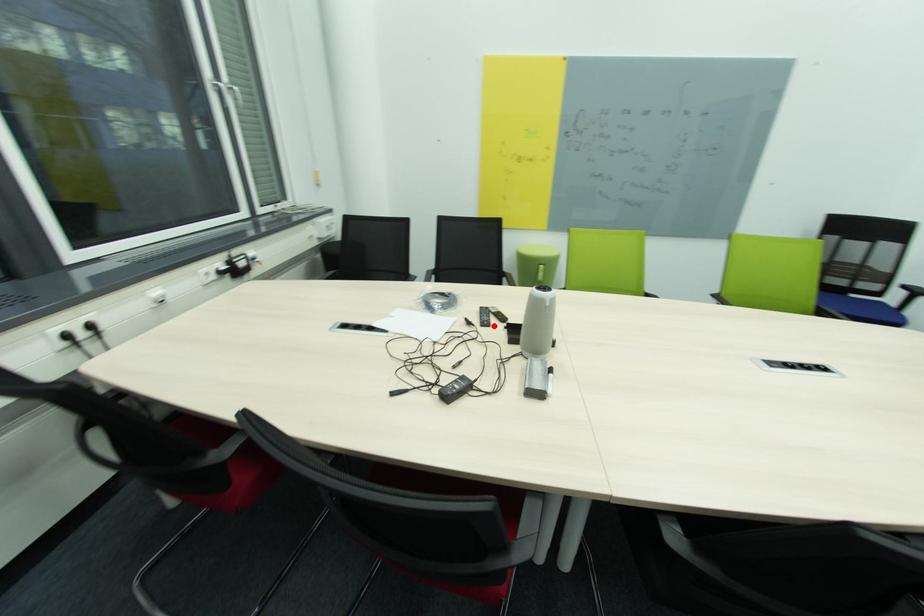
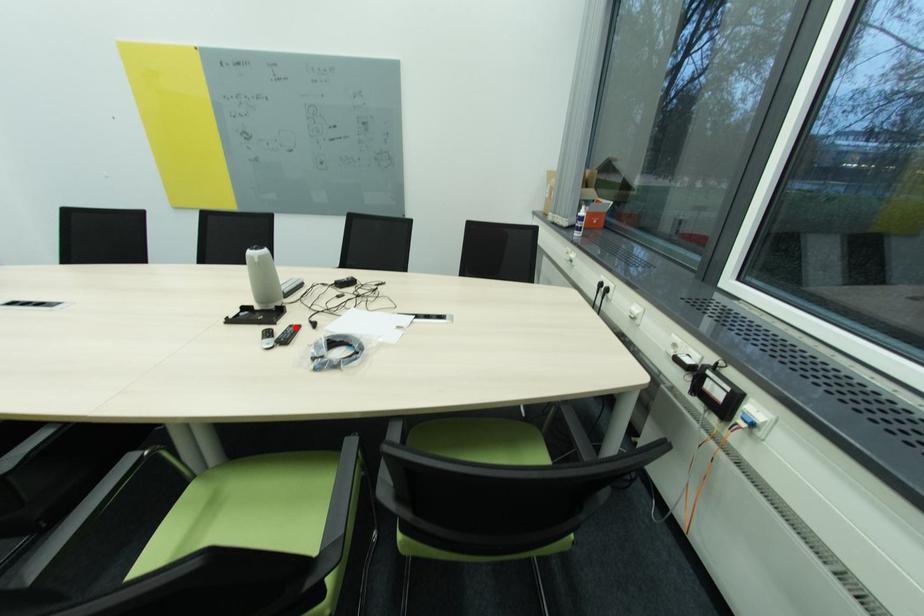
I am providing you with two images of the same scene from different viewpoints. A red point is marked on the first image and another point is marked on the second image. Do the highlighted points in image1 and image2 indicate the same real-world spot?

Yes